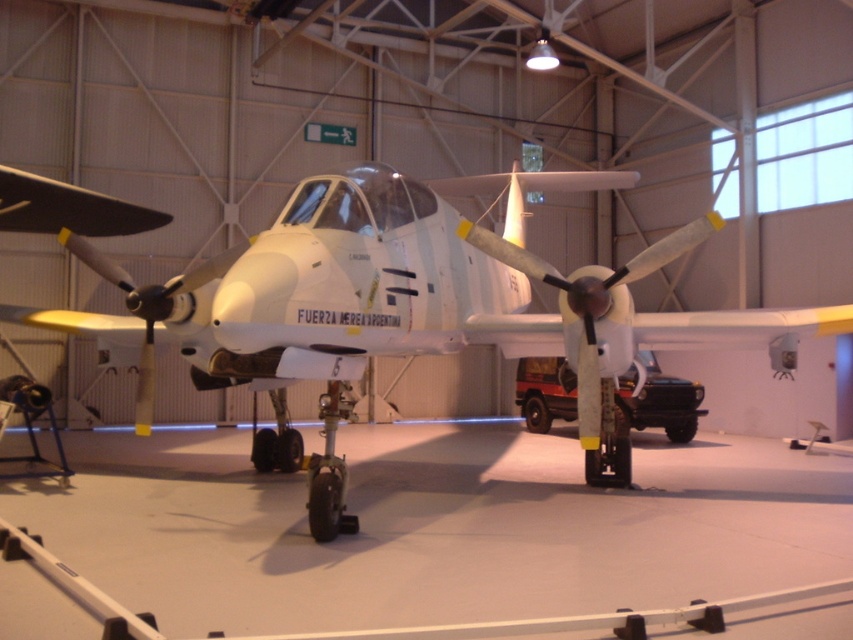
How far apart are white matte airplane at center and white matte propeller at center?

3.77 meters

Between white matte airplane at center and white matte propeller at center, which one has more height?

white matte propeller at center is taller.

Locate an element on the screen. white matte airplane at center is located at coordinates (386, 298).